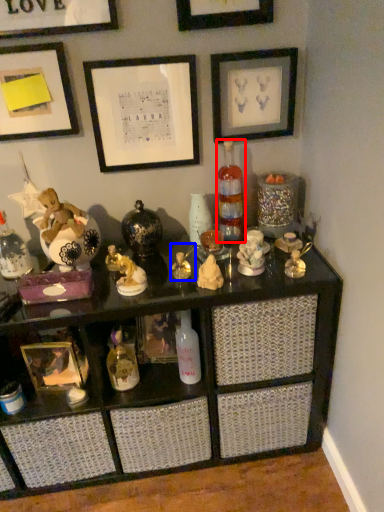
Question: Which object appears closest to the camera in this image, bottle (highlighted by a red box) or toy (highlighted by a blue box)?

Choices:
 (A) bottle
 (B) toy

Answer: (B)